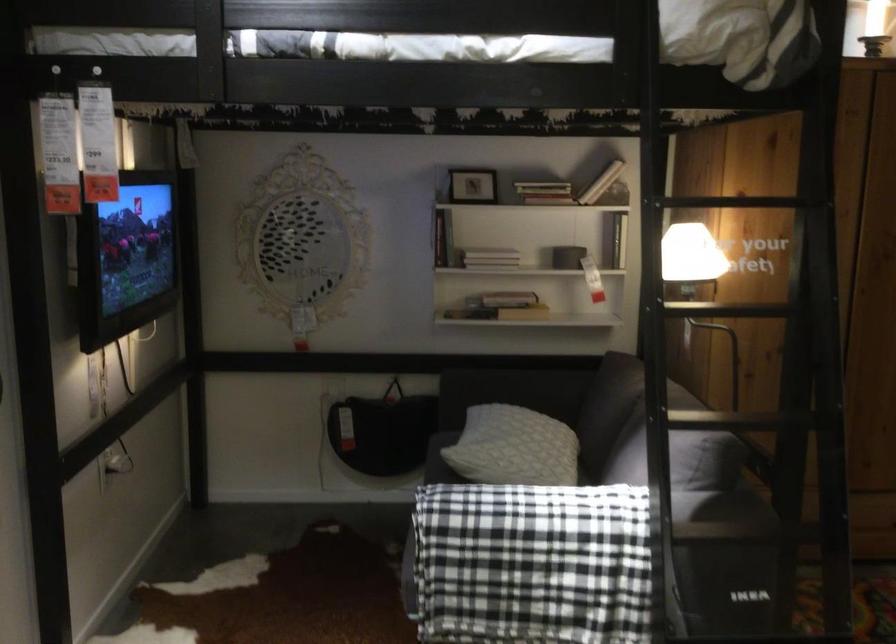
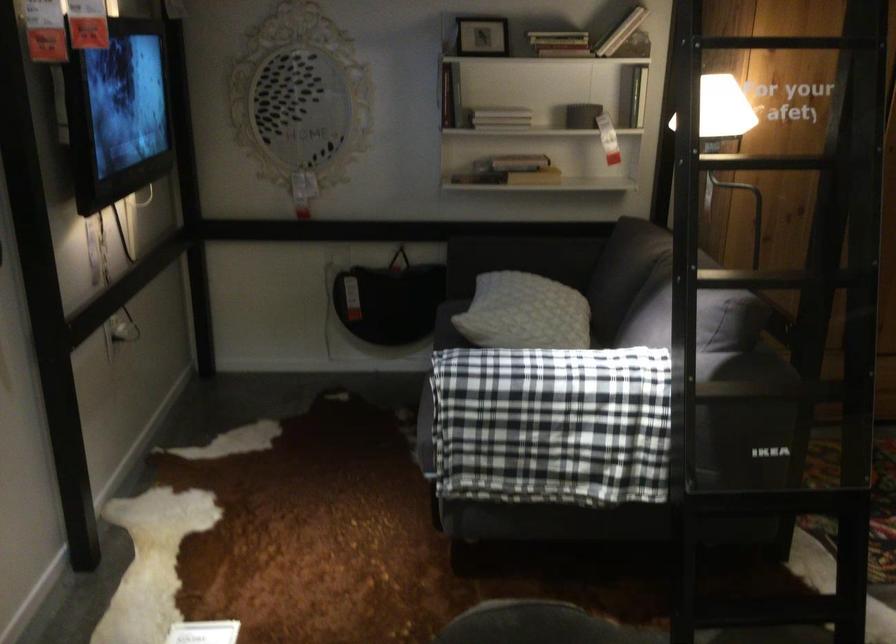
Find the pixel in the second image that matches point (513, 451) in the first image.

(524, 313)